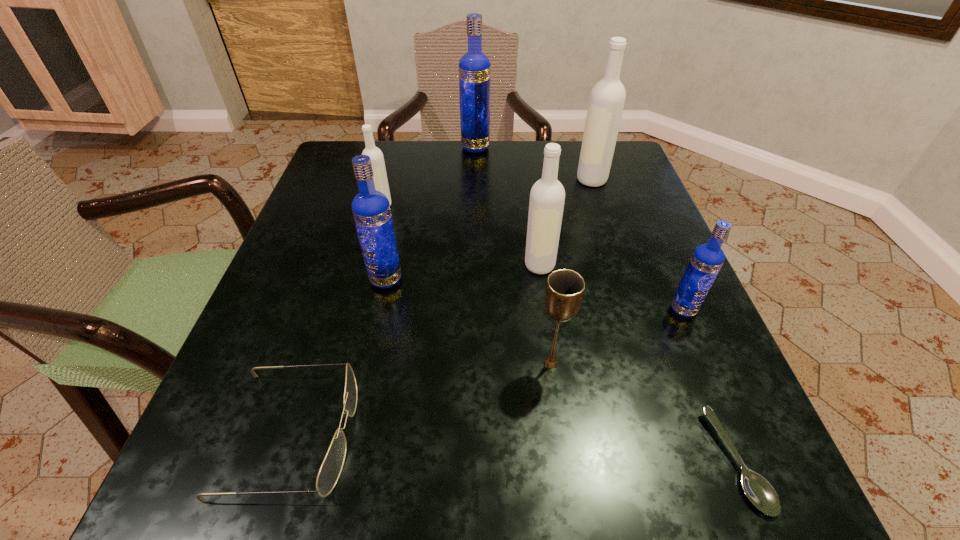
The height and width of the screenshot is (540, 960). In order to click on vodka that stands as the third closest to the third vodka from right to left in this screenshot , I will do point(607,98).

You are a GUI agent. You are given a task and a screenshot of the screen. Output one action in this format:
    pyautogui.click(x=<x>, y=<y>)
    Task: Click on the blue vodka that is the third nearest to the fourth nearest vodka
    The height and width of the screenshot is (540, 960).
    Given the screenshot: What is the action you would take?
    pyautogui.click(x=707, y=259)

Choose which blue vodka is the second nearest neighbor to the soupspoon. Please provide its 2D coordinates. Your answer should be formatted as a tuple, i.e. [(x, y)], where the tuple contains the x and y coordinates of a point satisfying the conditions above.

[(371, 210)]

In order to click on white vodka identified as the closest to the third object from right to left in this screenshot , I will do `click(547, 196)`.

Locate an element on the screen. Image resolution: width=960 pixels, height=540 pixels. white vodka that is the third closest one to the smallest blue vodka is located at coordinates (377, 160).

Where is `vacant position in the image that satisfies the following two spatial constraints: 1. on the front side of the soupspoon; 2. on the right side of the second white vodka from right to left`? The width and height of the screenshot is (960, 540). vacant position in the image that satisfies the following two spatial constraints: 1. on the front side of the soupspoon; 2. on the right side of the second white vodka from right to left is located at coordinates (566, 461).

Identify the location of free point that satisfies the following two spatial constraints: 1. on the front side of the second blue vodka from left to right; 2. on the right side of the rightmost vodka. (473, 309).

Identify the location of free space that satisfies the following two spatial constraints: 1. on the back side of the farthest white vodka; 2. on the right side of the third farthest vodka. (389, 179).